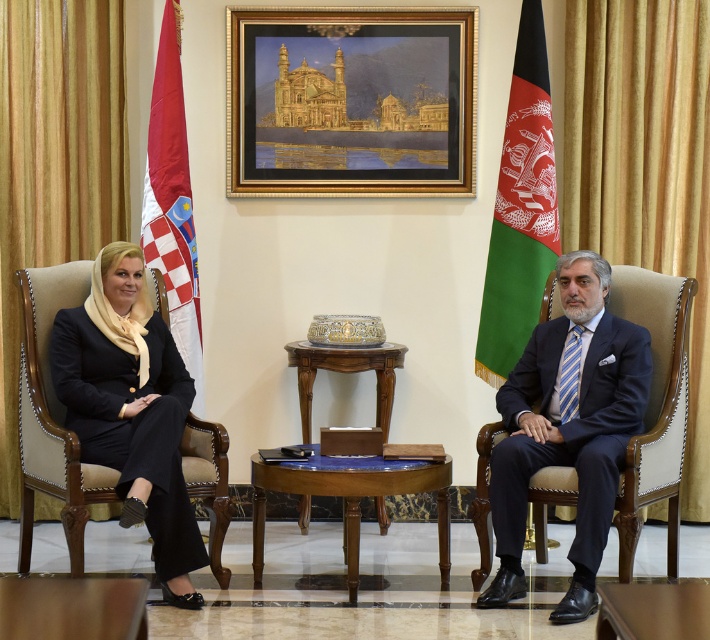
You are standing in the meeting room and want to walk towards the two points labeled point (390,51) and point (667,404). Which point will you reach first?

Point (390,51) is closer to you than point (667,404), so you will reach point (390,51) first.